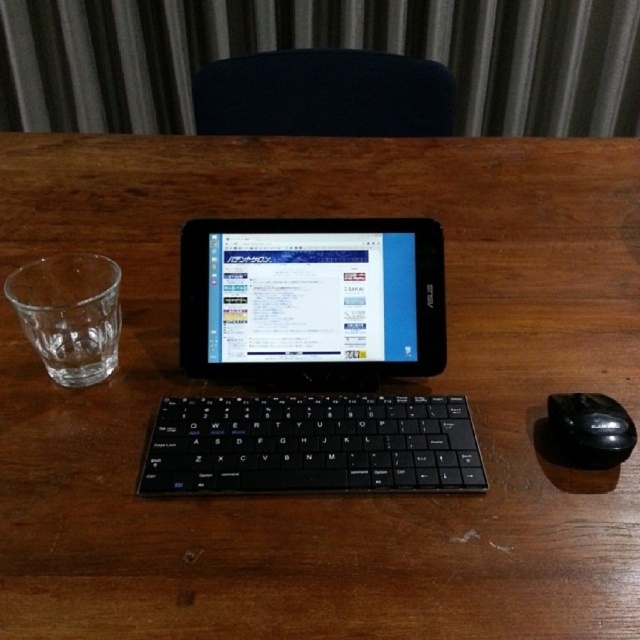
You are organizing your desk and need to place both the black plastic tablet at center and the transparent glass at left into a drawer. The drawer has a width of 12 inches. Based on their sizes, can both items fit side by side in the drawer?

The black plastic tablet at center might be wider than transparent glass at left. Since the drawer is 12 inches wide, it depends on the exact widths of both items. If the combined width of both items is less than or equal to 12 inches, they can fit side by side. However, if the tablet is significantly wider than the glass, they might not fit together. Without precise measurements, it is uncertain.

You are organizing your desk and need to place a new item between the black plastic tablet at center and the transparent glass at left. Based on their positions, where should you place the new item?

The black plastic tablet at center is to the right of the transparent glass at left, so you should place the new item between them by positioning it to the right of the transparent glass at left and to the left of the black plastic tablet at center.